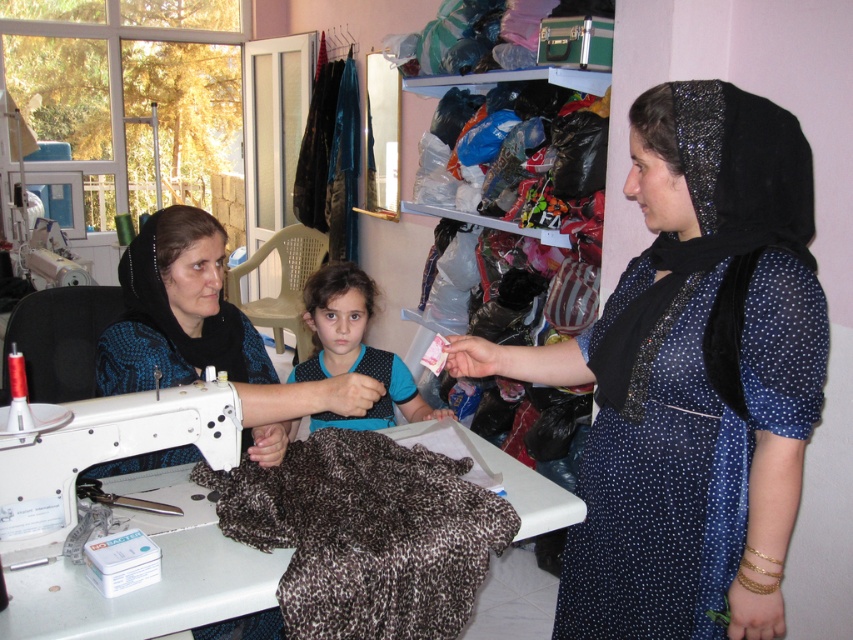
What are the coordinates of the brown textured fabric at center?

The coordinates of the brown textured fabric at center are at point (364,532).

You are a delivery person who needs to place a new sewing machine box that is 10 cm wider than the current white plastic sewing machine at lower left. Can you fit the new box next to the brown fuzzy fabric at lower left without moving anything else?

The white plastic sewing machine at lower left is thinner than the brown fuzzy fabric at lower left. The new box is 10 cm wider than the white plastic sewing machine at lower left, so it would be wider than the brown fuzzy fabric at lower left. Therefore, it cannot fit next to the brown fuzzy fabric at lower left without moving something else.